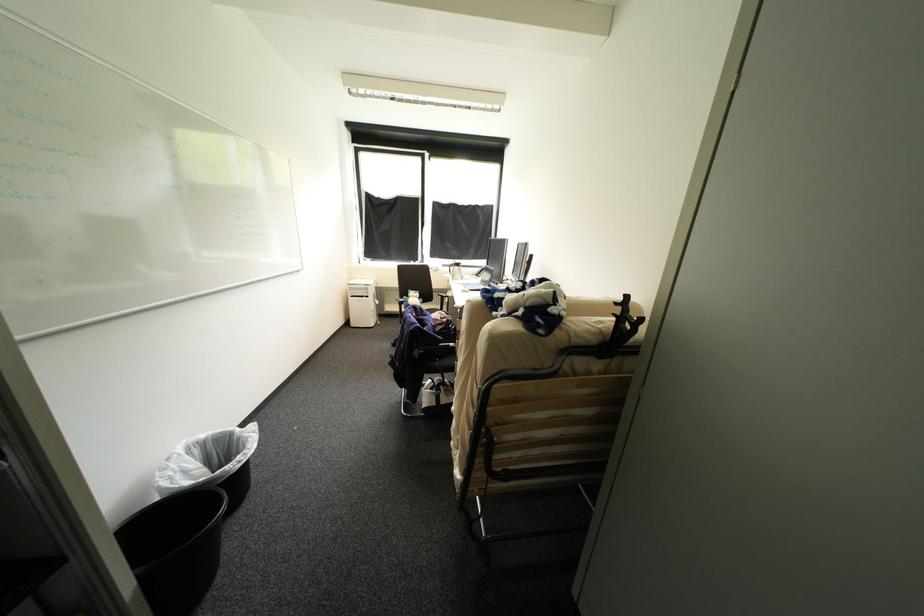
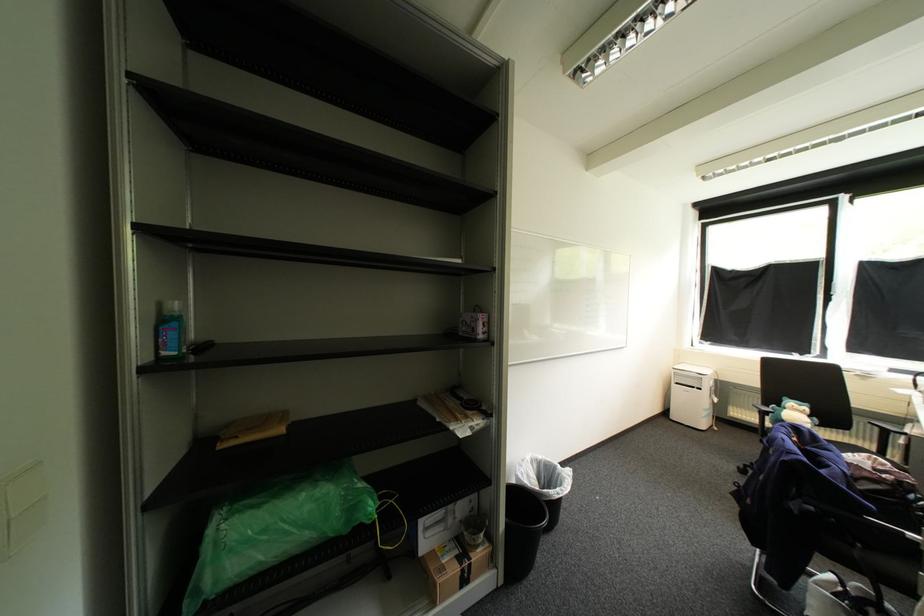
Where in the second image is the point corresponding to (141,569) from the first image?

(513, 517)